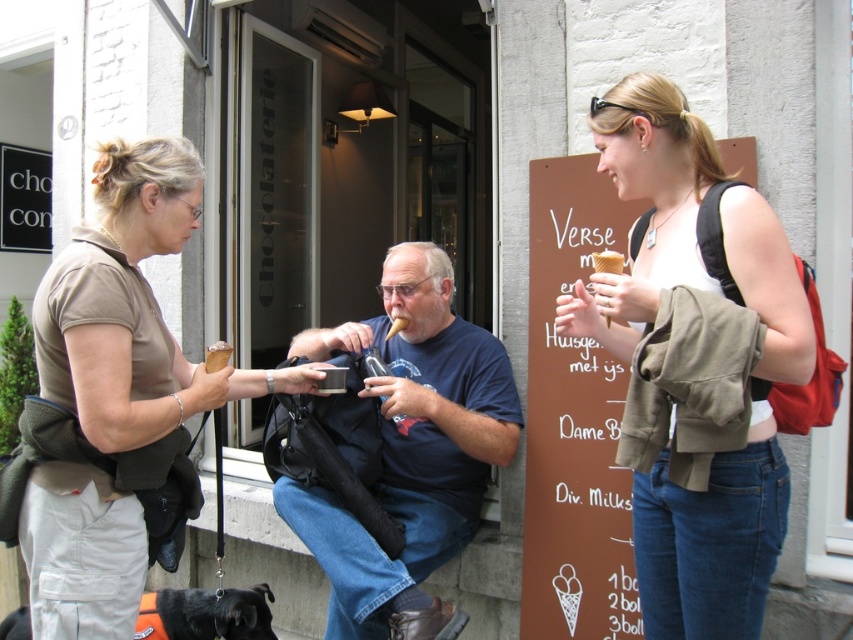
Question: Does matte brown shirt at left come in front of dark blue t-shirt at center?

Choices:
 (A) yes
 (B) no

Answer: (A)

Question: Which point appears closest to the camera in this image?

Choices:
 (A) (340, 621)
 (B) (26, 524)

Answer: (B)

Question: Among these points, which one is nearest to the camera?

Choices:
 (A) (776, 497)
 (B) (166, 211)

Answer: (A)

Question: Which point is farther to the camera?

Choices:
 (A) (447, 548)
 (B) (747, 538)
 (C) (93, 413)

Answer: (A)

Question: Does matte brown shirt at left come in front of dark blue t-shirt at center?

Choices:
 (A) no
 (B) yes

Answer: (B)

Question: Considering the relative positions of matte white ice cream cone at center and matte brown shirt at left in the image provided, where is matte white ice cream cone at center located with respect to matte brown shirt at left?

Choices:
 (A) left
 (B) right

Answer: (B)